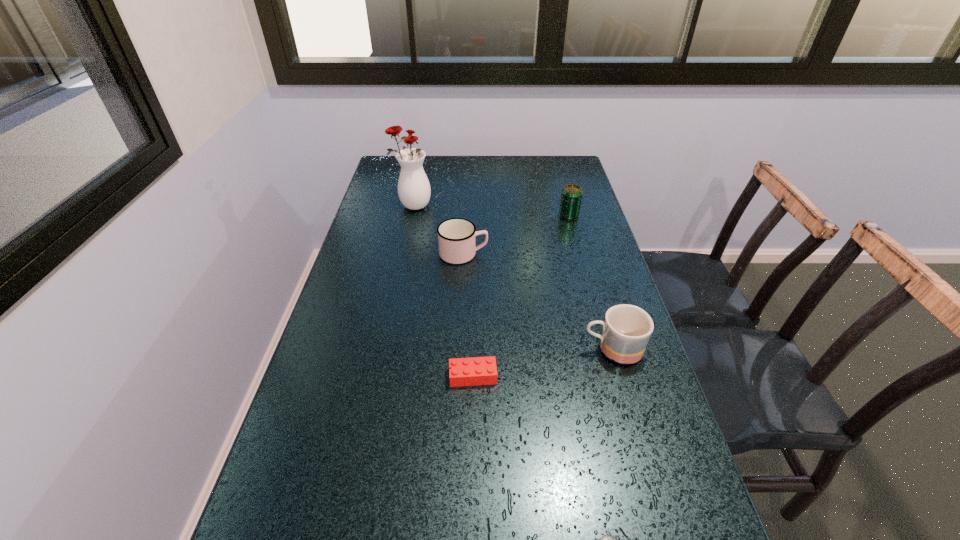
The height and width of the screenshot is (540, 960). Identify the location of vacant region at the far right corner. (563, 172).

Where is `vacant region between the fourth nearest object and the nearer mug`? vacant region between the fourth nearest object and the nearer mug is located at coordinates (538, 301).

Identify the location of empty space that is in between the right mug and the beer can. (590, 282).

Identify the location of free spot between the shortest object and the farther mug. The width and height of the screenshot is (960, 540). (468, 315).

Where is `free space between the tallest object and the beer can`? The height and width of the screenshot is (540, 960). free space between the tallest object and the beer can is located at coordinates (491, 211).

Identify the location of free spot between the tallest object and the shortest object. This screenshot has width=960, height=540. (443, 291).

Where is `empty space that is in between the right mug and the tallest object`? Image resolution: width=960 pixels, height=540 pixels. empty space that is in between the right mug and the tallest object is located at coordinates (513, 278).

Identify the location of free point between the right mug and the beer can. This screenshot has width=960, height=540. (590, 282).

Image resolution: width=960 pixels, height=540 pixels. I want to click on free space between the beer can and the leftmost object, so click(x=491, y=211).

Identify the location of free space between the Lego and the fourth nearest object. (468, 315).